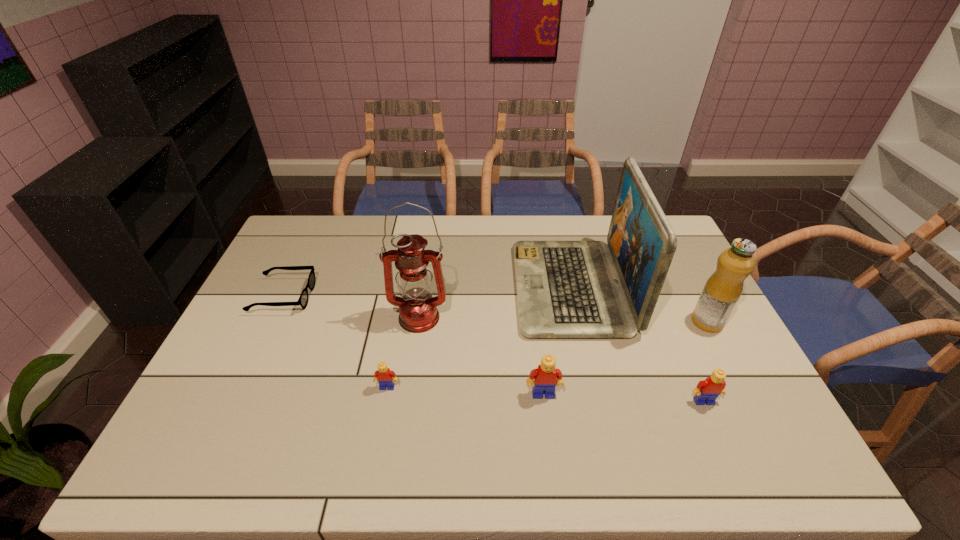
Please point a spot to add another Lego on the left. Please provide its 2D coordinates. Your answer should be formatted as a tuple, i.e. [(x, y)], where the tuple contains the x and y coordinates of a point satisfying the conditions above.

[(235, 381)]